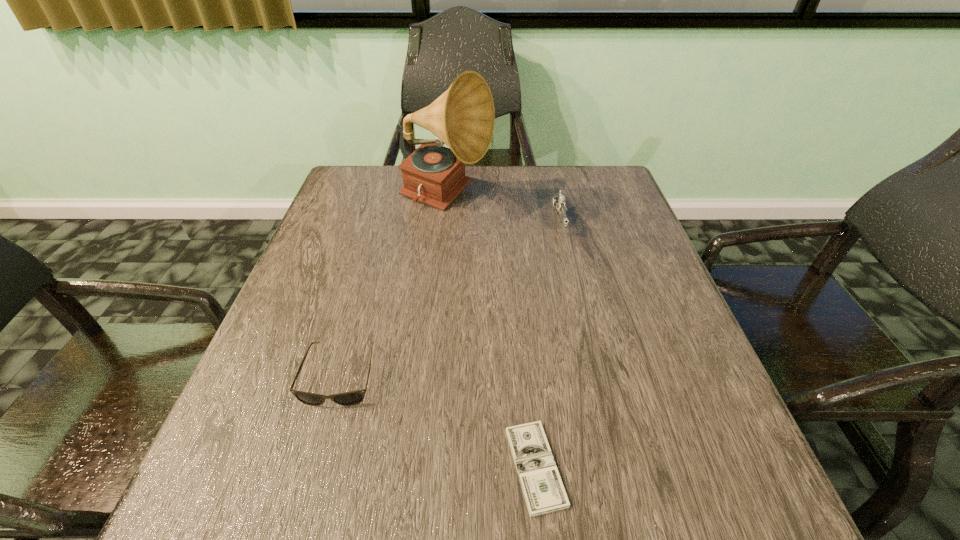
You are a GUI agent. You are given a task and a screenshot of the screen. Output one action in this format:
    pyautogui.click(x=<x>, y=<y>)
    Task: Click on the free location located on the left of the dollar
    
    Given the screenshot: What is the action you would take?
    pyautogui.click(x=357, y=467)

Where is `phonograph record present at the far edge`? phonograph record present at the far edge is located at coordinates (463, 117).

I want to click on gun present at the far edge, so click(x=559, y=202).

The image size is (960, 540). Identify the location of object at the near edge. (542, 486).

What are the coordinates of `object located in the left edge section of the desktop` in the screenshot? It's located at (350, 398).

This screenshot has height=540, width=960. Identify the location of free space at the far edge. (519, 192).

The width and height of the screenshot is (960, 540). In the image, there is a desktop. What are the coordinates of `vacant space at the near edge` in the screenshot? It's located at (594, 491).

This screenshot has height=540, width=960. In the image, there is a desktop. What are the coordinates of `vacant space at the left edge` in the screenshot? It's located at (287, 384).

You are a GUI agent. You are given a task and a screenshot of the screen. Output one action in this format:
    pyautogui.click(x=<x>, y=<y>)
    Task: Click on the blank space at the right edge of the desktop
    This screenshot has height=540, width=960.
    Given the screenshot: What is the action you would take?
    pyautogui.click(x=665, y=324)

Where is `vacant space at the far left corner of the desktop`? vacant space at the far left corner of the desktop is located at coordinates (356, 166).